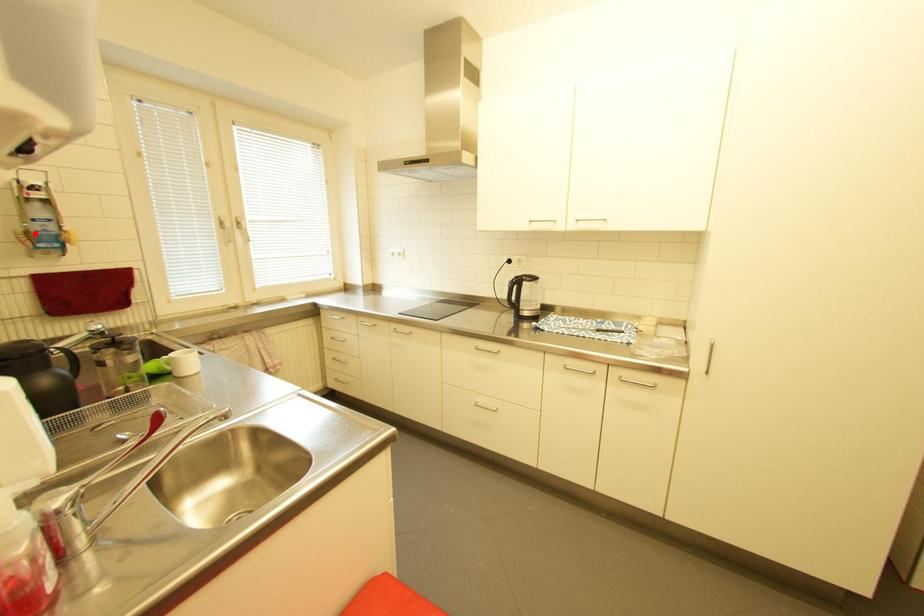
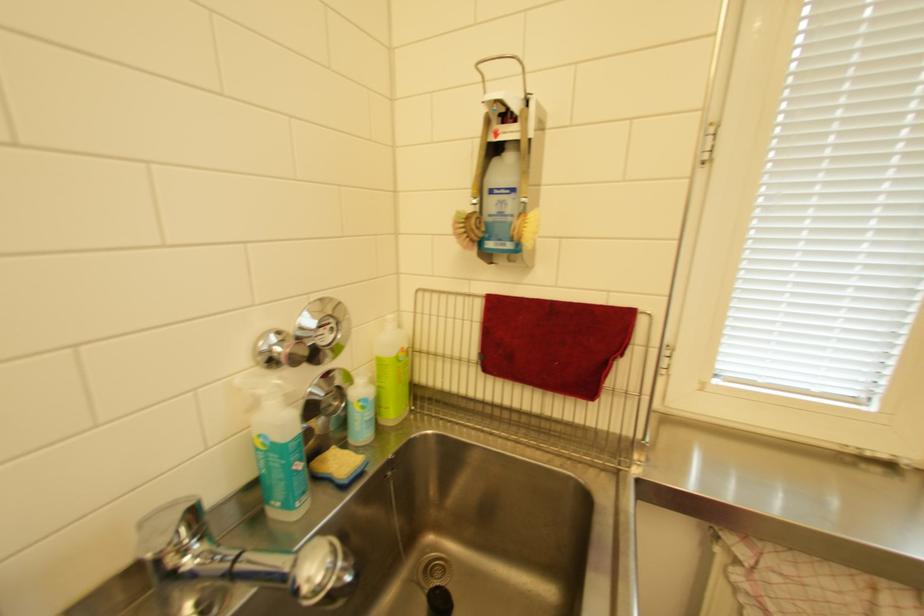
Locate, in the second image, the point that corresponds to the highlighted location in the first image.

(475, 217)